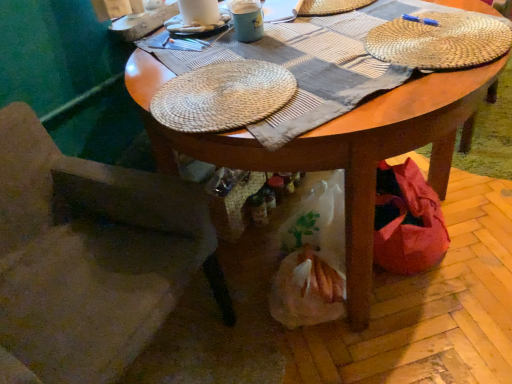
Find the location of a particular element. free space that is to the left of woven straw placemat at upper right, which appears as the 2th hat when ordered from the bottom is located at coordinates (332, 65).